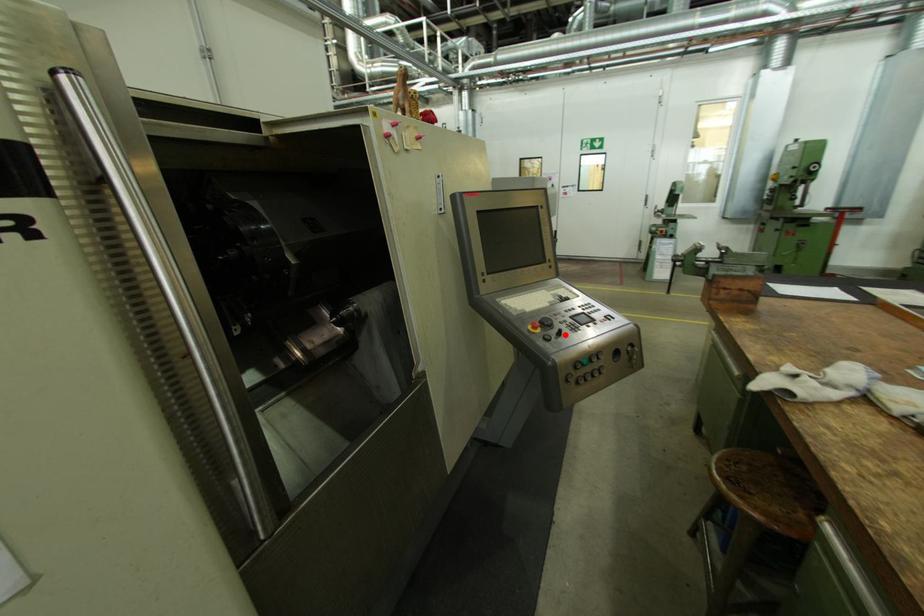
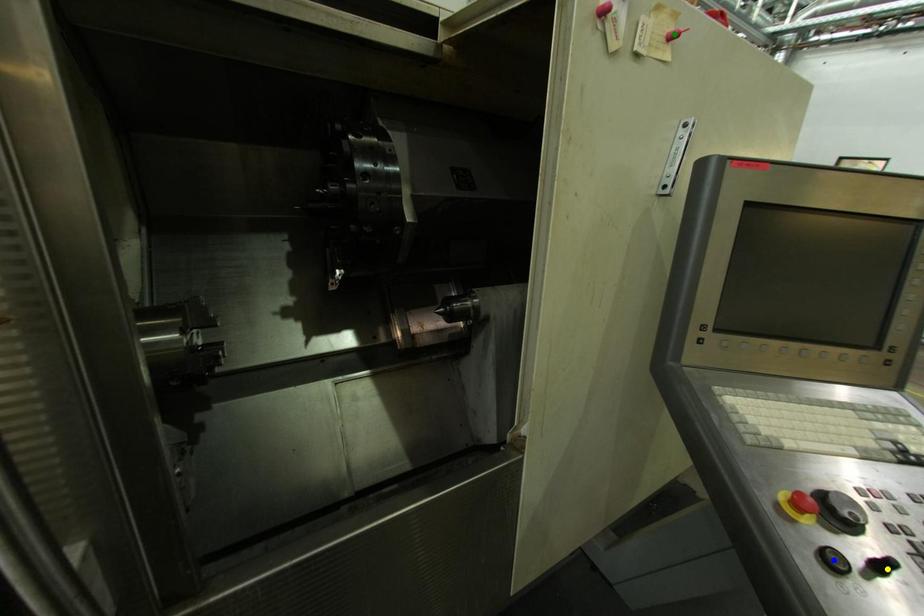
Question: I am providing you with two images of the same scene from different viewpoints. A red point is marked on the first image. You are given multiple points on the second image. Can you choose the point in image 2 that corresponds to the point in image 1?

Choices:
 (A) yellow point
 (B) green point
 (C) blue point

Answer: (A)